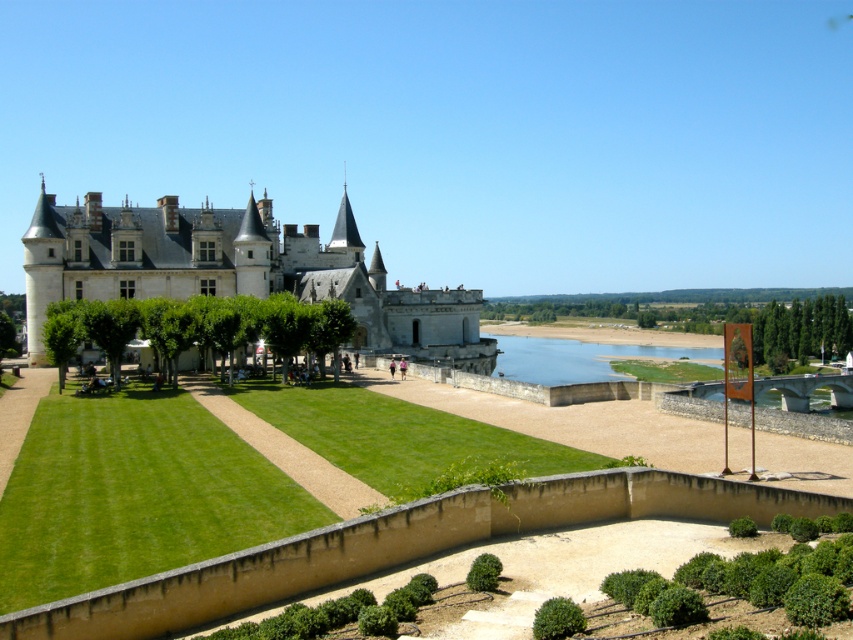
You are a tour guide leading a group to the green grassy lake at lower center from the white stone castle at center. The group has a 50 meter walking limit. Can you reach the lake within the limit?

The white stone castle at center is 62.27 meters away from the green grassy lake at lower center, so the group cannot reach the lake within the 50 meter walking limit.

You are standing at the castle entrance and want to reach the point marked by point [642,515] and point [263,269]. Which point is closer to you?

Point [642,515] is in front of point [263,269], so it is closer to you.

You are a tourist standing on the gravel pathway near the brown stone moat at lower center and want to take a photo of the white stone castle at center. Since the moat is between you and the castle, will the moat block your view of the castle?

The brown stone moat at lower center has a lesser height compared to white stone castle at center, so the moat will not block your view of the castle as it is shorter than the castle.